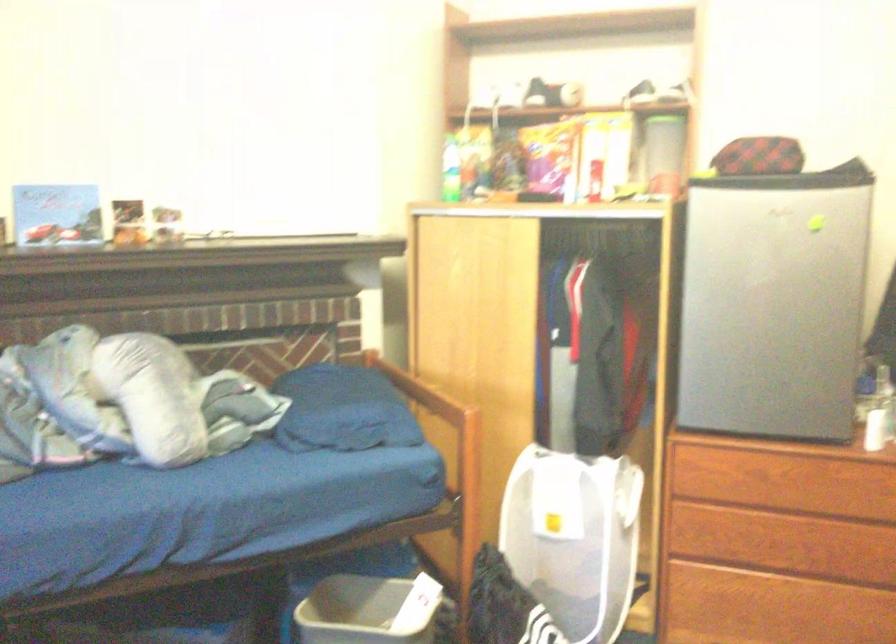
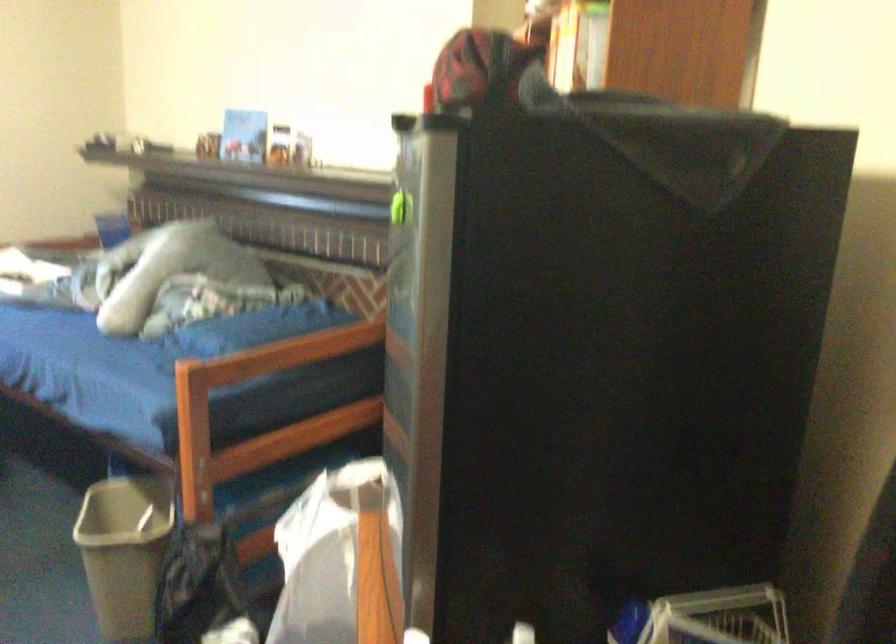
Locate, in the second image, the point that corresponds to point 812,237 in the first image.

(400, 207)